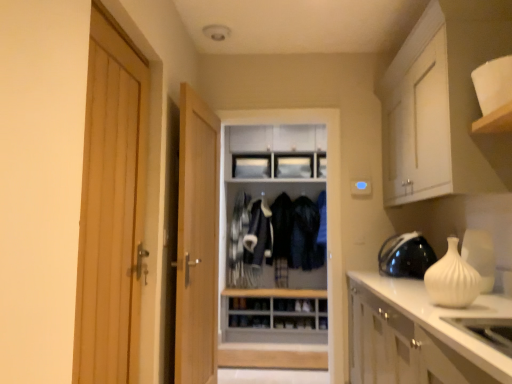
Where is `black glossy helmet at right`? This screenshot has width=512, height=384. black glossy helmet at right is located at coordinates (406, 256).

Describe the element at coordinates (406, 256) in the screenshot. I see `black glossy helmet at right` at that location.

How much space does light wood door at center, marked as the 2th door in a front-to-back arrangement, occupy vertically?

light wood door at center, marked as the 2th door in a front-to-back arrangement, is 6.35 feet tall.

What do you see at coordinates (444, 104) in the screenshot?
I see `white matte cabinet at upper right, which ranks as the 2th cabinetry in bottom-to-top order` at bounding box center [444, 104].

Identify the location of white matte cabinet at upper right, acting as the first cabinetry starting from the top. (444, 104).

This screenshot has height=384, width=512. What are the coordinates of `light wood door at left, which ranks as the 2th door in right-to-left order` in the screenshot? It's located at coord(111,207).

In order to face dark blue fabric jacket at center, which is the 1th clothing from left to right, should I rotate leftwards or rightwards?

You should look right and rotate roughly 3.221 degrees.

In order to face white matte vase at right, should I rotate leftwards or rightwards?

Turn right by 24.363 degrees to look at white matte vase at right.

Where is `black glossy helmet at right`? black glossy helmet at right is located at coordinates (406, 256).

From the picture: Which of these two, white matte vase at right or light wood door at left, which is the first door from left to right, is thinner?

light wood door at left, which is the first door from left to right.

Can you confirm if white matte vase at right is positioned to the right of light wood door at left, marked as the 2th door in a back-to-front arrangement?

Indeed, white matte vase at right is positioned on the right side of light wood door at left, marked as the 2th door in a back-to-front arrangement.

What's the angular difference between white matte vase at right and light wood door at left, which is the 1th door from front to back,'s facing directions?

They differ by 179 degrees in their facing directions.

Would you say white matte vase at right is a long distance from light wood door at left, marked as the 2th door in a back-to-front arrangement?

Yes, white matte vase at right and light wood door at left, marked as the 2th door in a back-to-front arrangement, are located far from each other.

Is the depth of white matte cabinet at upper right, acting as the first cabinetry starting from the top, less than that of wooden dresser at center?

Yes, white matte cabinet at upper right, acting as the first cabinetry starting from the top, is in front of wooden dresser at center.

Can you confirm if white matte cabinet at upper right, acting as the first cabinetry starting from the top, is positioned to the right of wooden dresser at center?

Correct, you'll find white matte cabinet at upper right, acting as the first cabinetry starting from the top, to the right of wooden dresser at center.

From the image's perspective, is white matte cabinet at upper right, which ranks as the 2th cabinetry in bottom-to-top order, above or below wooden dresser at center?

Clearly, from the image's perspective, white matte cabinet at upper right, which ranks as the 2th cabinetry in bottom-to-top order, is above wooden dresser at center.

In terms of size, does white matte cabinet at upper right, which ranks as the 2th cabinetry in bottom-to-top order, appear bigger or smaller than wooden dresser at center?

white matte cabinet at upper right, which ranks as the 2th cabinetry in bottom-to-top order, is smaller than wooden dresser at center.

Is dark blue fabric jacket at center, acting as the second clothing starting from the left, oriented away from white glossy countertop at lower right, the first cabinetry from the bottom?

No, dark blue fabric jacket at center, acting as the second clothing starting from the left,'s orientation is not away from white glossy countertop at lower right, the first cabinetry from the bottom.

Is the position of dark blue fabric jacket at center, acting as the second clothing starting from the left, more distant than that of white glossy countertop at lower right, marked as the second cabinetry in a top-to-bottom arrangement?

Yes.

Does dark blue fabric jacket at center, acting as the second clothing starting from the left, have a smaller size compared to white glossy countertop at lower right, marked as the second cabinetry in a top-to-bottom arrangement?

Yes, dark blue fabric jacket at center, acting as the second clothing starting from the left, is smaller than white glossy countertop at lower right, marked as the second cabinetry in a top-to-bottom arrangement.

In order to click on the 1st cabinetry counting from the right of the dark blue fabric jacket at center, acting as the second clothing starting from the left in this screenshot , I will do `click(418, 335)`.

Based on the photo, is wooden dresser at center next to white glossy countertop at lower right, the first cabinetry from the bottom?

No.

Considering the positions of point (329, 278) and point (407, 336), is point (329, 278) closer or farther from the camera than point (407, 336)?

Point (329, 278) is farther from the camera than point (407, 336).

Can you confirm if wooden dresser at center is smaller than white glossy countertop at lower right, marked as the second cabinetry in a top-to-bottom arrangement?

No, wooden dresser at center is not smaller than white glossy countertop at lower right, marked as the second cabinetry in a top-to-bottom arrangement.

Does dark blue fabric jacket at center, which is the 1th clothing from left to right, appear on the right side of light wood door at left, marked as the 2th door in a back-to-front arrangement?

Indeed, dark blue fabric jacket at center, which is the 1th clothing from left to right, is positioned on the right side of light wood door at left, marked as the 2th door in a back-to-front arrangement.

Considering the positions of point (275, 240) and point (100, 314), is point (275, 240) closer or farther from the camera than point (100, 314)?

Point (275, 240).

From the image's perspective, does dark blue fabric jacket at center, the 2th clothing when ordered from right to left, appear higher than light wood door at left, which ranks as the 2th door in right-to-left order?

Actually, dark blue fabric jacket at center, the 2th clothing when ordered from right to left, appears below light wood door at left, which ranks as the 2th door in right-to-left order, in the image.

Considering the sizes of objects wooden dresser at center and white matte vase at right in the image provided, who is shorter, wooden dresser at center or white matte vase at right?

With less height is white matte vase at right.

Who is smaller, wooden dresser at center or white matte vase at right?

Smaller between the two is white matte vase at right.

Can you tell me how much wooden dresser at center and white matte vase at right differ in facing direction?

90.9 degrees.

From a real-world perspective, between wooden dresser at center and white matte vase at right, who is vertically higher?

wooden dresser at center.

Would you say white matte cabinet at upper right, which ranks as the 2th cabinetry in bottom-to-top order, is part of dark blue fabric jacket at center, which is the 1th clothing from left to right,'s contents?

No, white matte cabinet at upper right, which ranks as the 2th cabinetry in bottom-to-top order, is located outside of dark blue fabric jacket at center, which is the 1th clothing from left to right.

From the image's perspective, is dark blue fabric jacket at center, which is the 1th clothing from left to right, located beneath white matte cabinet at upper right, which ranks as the 2th cabinetry in bottom-to-top order?

Correct, dark blue fabric jacket at center, which is the 1th clothing from left to right, appears lower than white matte cabinet at upper right, which ranks as the 2th cabinetry in bottom-to-top order, in the image.

This screenshot has height=384, width=512. I want to click on cabinetry lying above the dark blue fabric jacket at center, which is the 1th clothing from left to right (from the image's perspective), so click(444, 104).

Considering the relative positions of dark blue fabric jacket at center, the 2th clothing when ordered from right to left, and white matte cabinet at upper right, acting as the first cabinetry starting from the top, in the image provided, is dark blue fabric jacket at center, the 2th clothing when ordered from right to left, behind white matte cabinet at upper right, acting as the first cabinetry starting from the top,?

Yes, it is.

At what (x,y) coordinates should I click in order to perform the action: click on vase below the light wood door at left, marked as the 2th door in a back-to-front arrangement (from the image's perspective). Please return your answer as a coordinate pair (x, y). Looking at the image, I should click on (452, 279).

Where is `dresser below the white matte cabinet at upper right, which ranks as the 2th cabinetry in bottom-to-top order (from a real-world perspective)`? dresser below the white matte cabinet at upper right, which ranks as the 2th cabinetry in bottom-to-top order (from a real-world perspective) is located at coordinates (273, 267).

Looking at the image, which one is located closer to white matte cabinet at upper right, which ranks as the 2th cabinetry in bottom-to-top order, dark blue fabric jacket at center, which is the 1th clothing from left to right, or black glossy helmet at right?

black glossy helmet at right is closer to white matte cabinet at upper right, which ranks as the 2th cabinetry in bottom-to-top order.

Based on their spatial positions, is dark blue fabric jacket at center, which is the 1th clothing from left to right, or wooden dresser at center closer to light wood door at left, which is the 1th door from front to back?

wooden dresser at center lies closer to light wood door at left, which is the 1th door from front to back, than the other object.

When comparing their distances from light wood door at center, marked as the 2th door in a front-to-back arrangement, does white matte cabinet at upper right, which ranks as the 2th cabinetry in bottom-to-top order, or wooden dresser at center seem closer?

The object closer to light wood door at center, marked as the 2th door in a front-to-back arrangement, is white matte cabinet at upper right, which ranks as the 2th cabinetry in bottom-to-top order.

When comparing their distances from dark blue fabric jacket at center, which is the 1th clothing from left to right, does white matte vase at right or light wood door at left, marked as the 2th door in a back-to-front arrangement, seem closer?

light wood door at left, marked as the 2th door in a back-to-front arrangement, is closer to dark blue fabric jacket at center, which is the 1th clothing from left to right.

Estimate the real-world distances between objects in this image. Which object is further from white glossy countertop at lower right, marked as the second cabinetry in a top-to-bottom arrangement, wooden dresser at center or white matte vase at right?

wooden dresser at center lies further to white glossy countertop at lower right, marked as the second cabinetry in a top-to-bottom arrangement, than the other object.

From the image, which object appears to be nearer to white matte cabinet at upper right, which ranks as the 2th cabinetry in bottom-to-top order, black glossy helmet at right or white matte vase at right?

Based on the image, black glossy helmet at right appears to be nearer to white matte cabinet at upper right, which ranks as the 2th cabinetry in bottom-to-top order.

Which object lies nearer to the anchor point white glossy countertop at lower right, the first cabinetry from the bottom, black glossy helmet at right or light wood door at left, marked as the 2th door in a back-to-front arrangement?

black glossy helmet at right.

Considering their positions, is dark blue fabric jacket at center, acting as the second clothing starting from the left, positioned closer to white matte vase at right than white glossy countertop at lower right, marked as the second cabinetry in a top-to-bottom arrangement?

Based on the image, white glossy countertop at lower right, marked as the second cabinetry in a top-to-bottom arrangement, appears to be nearer to white matte vase at right.

Locate an element on the screen. Image resolution: width=512 pixels, height=384 pixels. door positioned between white matte vase at right and dark blue fabric jacket at center, which is the 1th clothing from left to right, from near to far is located at coordinates (197, 242).

Locate an element on the screen. The image size is (512, 384). vase located between light wood door at center, positioned as the first door in right-to-left order, and black glossy helmet at right in the left-right direction is located at coordinates (452, 279).

Where is `cabinetry positioned between white glossy countertop at lower right, marked as the second cabinetry in a top-to-bottom arrangement, and dark blue fabric jacket at center, the 2th clothing when ordered from right to left, from near to far`? cabinetry positioned between white glossy countertop at lower right, marked as the second cabinetry in a top-to-bottom arrangement, and dark blue fabric jacket at center, the 2th clothing when ordered from right to left, from near to far is located at coordinates coord(444,104).

You are a GUI agent. You are given a task and a screenshot of the screen. Output one action in this format:
    pyautogui.click(x=<x>, y=<y>)
    Task: Click on the door between light wood door at left, marked as the 2th door in a back-to-front arrangement, and dark blue fabric jacket at center, the first clothing when ordered from right to left, along the z-axis
    This screenshot has width=512, height=384.
    Given the screenshot: What is the action you would take?
    pyautogui.click(x=197, y=242)